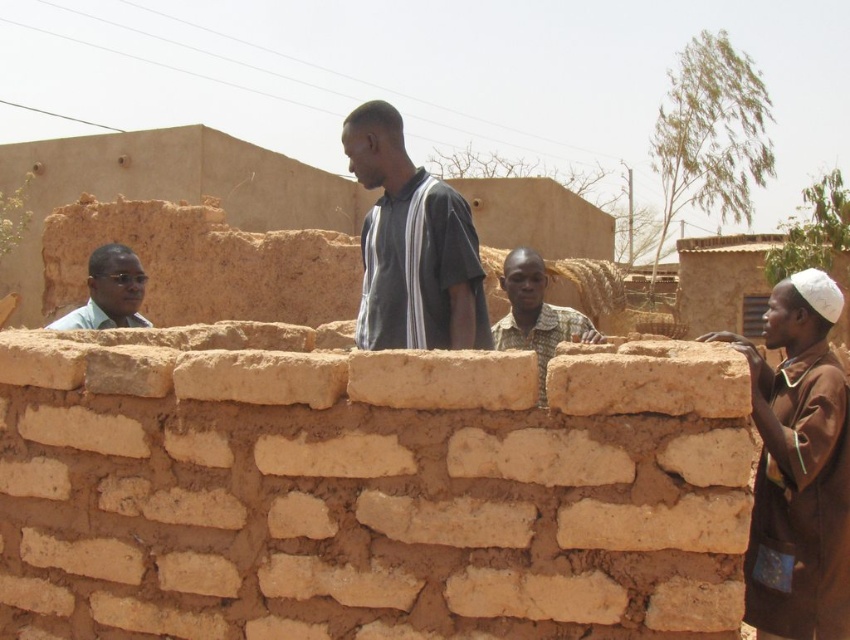
You are a drone operator trying to capture aerial footage of the construction site. You notice two points of interest marked as point 1 and point 2. If point 1 is at coordinates point (817, 502) and point 2 is at coordinates point (554, 324), which point should you focus on first to ensure it appears larger in your footage?

Point 1 at coordinates point (817, 502) should be focused on first because it is closer to the camera, making it appear larger in the footage compared to point 2 at coordinates point (554, 324).

You are standing at the origin point in the image. The brown mudbrick wall at center is located at coordinates approximately 0.773 on the x and 0.429 on the y. If you want to reach the wall as quickly as possible, in which general direction should you move from your current position?

To reach the brown mudbrick wall at center quickly, you should move in the direction of the coordinates 0.773 on the x and 0.429 on the y, which would generally be northeast if the origin is the bottom left corner. However, without knowing the exact coordinate system orientation, the most precise answer is to move towards the coordinates provided.

You are a photographer trying to capture a group photo of the construction workers. You notice the brown cotton shirt at right and the patterned fabric shirt at center. Which worker should you position closer to the camera to ensure both are in focus, considering their heights?

The brown cotton shirt at right is much taller than the patterned fabric shirt at center. To ensure both are in focus, position the shorter worker, the patterned fabric shirt at center, closer to the camera.